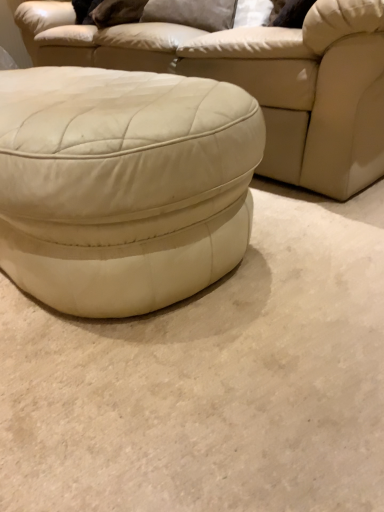
The height and width of the screenshot is (512, 384). In order to click on free space above white leather ottoman at center (from a real-world perspective) in this screenshot , I will do `click(92, 86)`.